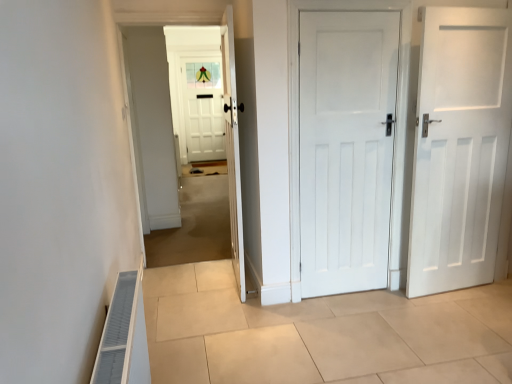
Question: Based on their sizes in the image, would you say beige tile floor at center is bigger or smaller than white wooden door at center, placed as the first door when sorted from left to right?

Choices:
 (A) small
 (B) big

Answer: (B)

Question: Is point (438, 352) positioned closer to the camera than point (230, 33)?

Choices:
 (A) closer
 (B) farther

Answer: (A)

Question: Estimate the real-world distances between objects in this image. Which object is farther from the white wooden door at center, placed as the first door when sorted from left to right?

Choices:
 (A) white matte door at right, arranged as the first door when viewed from the right
 (B) white wooden door at center
 (C) beige tile floor at center
 (D) white painted wood door at center, positioned as the second door in left-to-right order

Answer: (B)

Question: Which object is the closest to the white wooden door at center, placed as the third door when sorted from right to left?

Choices:
 (A) white painted wood door at center, positioned as the second door in left-to-right order
 (B) beige tile floor at center
 (C) white wooden door at center
 (D) white matte door at right, arranged as the first door when viewed from the right

Answer: (A)